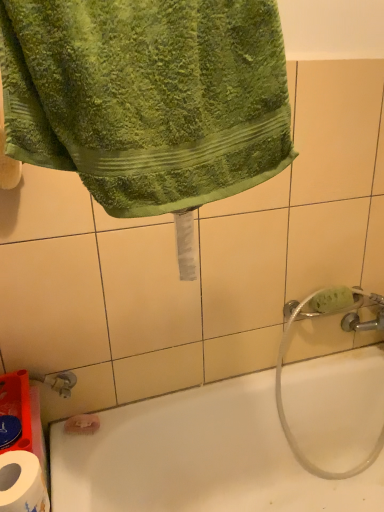
Question: Considering the relative sizes of white glossy bathtub at lower left and green sponge at right in the image provided, is white glossy bathtub at lower left taller than green sponge at right?

Choices:
 (A) no
 (B) yes

Answer: (B)

Question: Is white glossy bathtub at lower left located outside green sponge at right?

Choices:
 (A) yes
 (B) no

Answer: (A)

Question: Can you confirm if white glossy bathtub at lower left is smaller than green sponge at right?

Choices:
 (A) no
 (B) yes

Answer: (A)

Question: From a real-world perspective, is white glossy bathtub at lower left over green sponge at right?

Choices:
 (A) yes
 (B) no

Answer: (B)

Question: From the image's perspective, is white glossy bathtub at lower left beneath green sponge at right?

Choices:
 (A) no
 (B) yes

Answer: (B)

Question: Visually, is white glossy bathtub at lower left positioned to the left or to the right of green sponge at right?

Choices:
 (A) right
 (B) left

Answer: (B)

Question: From the image's perspective, is white glossy bathtub at lower left above or below green sponge at right?

Choices:
 (A) below
 (B) above

Answer: (A)

Question: Which is correct: white glossy bathtub at lower left is inside green sponge at right, or outside of it?

Choices:
 (A) inside
 (B) outside

Answer: (B)

Question: Considering their positions, is white glossy bathtub at lower left located in front of or behind green sponge at right?

Choices:
 (A) front
 (B) behind

Answer: (A)

Question: In terms of height, does transparent rubber garden hose at lower right look taller or shorter compared to green sponge at right?

Choices:
 (A) tall
 (B) short

Answer: (A)

Question: From the image's perspective, is transparent rubber garden hose at lower right above or below green sponge at right?

Choices:
 (A) below
 (B) above

Answer: (A)

Question: Visually, is transparent rubber garden hose at lower right positioned to the left or to the right of green sponge at right?

Choices:
 (A) left
 (B) right

Answer: (B)

Question: Is point (289, 328) positioned closer to the camera than point (329, 307)?

Choices:
 (A) closer
 (B) farther

Answer: (B)

Question: Looking at their shapes, would you say green terry cloth towel at upper left is wider or thinner than white paper at lower left?

Choices:
 (A) wide
 (B) thin

Answer: (B)

Question: From a real-world perspective, is green terry cloth towel at upper left above or below white paper at lower left?

Choices:
 (A) below
 (B) above

Answer: (B)